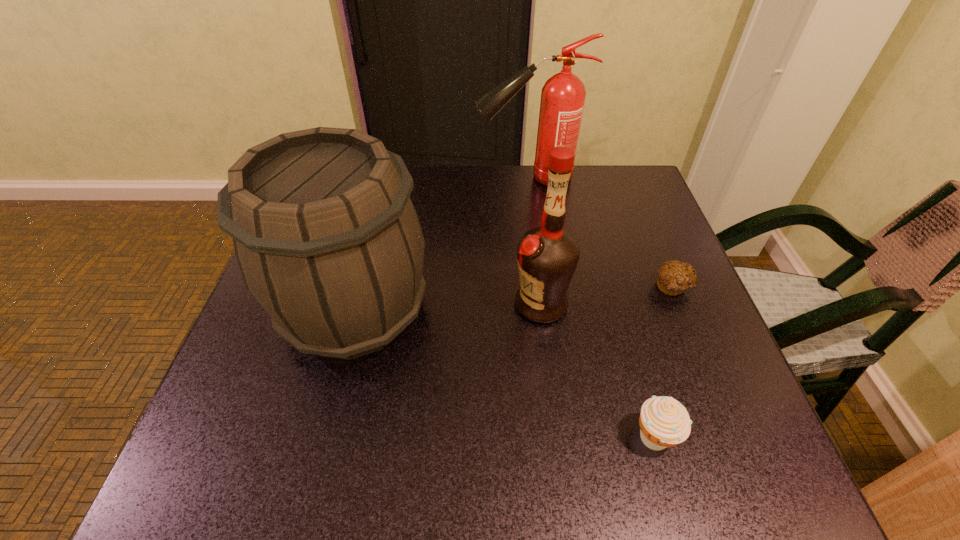
Find the location of a particular element. free region at the far edge of the desktop is located at coordinates (442, 193).

The width and height of the screenshot is (960, 540). I want to click on vacant region at the near edge, so click(513, 431).

In the image, there is a desktop. Identify the location of vacant space at the right edge. This screenshot has width=960, height=540. (642, 234).

In the image, there is a desktop. In order to click on blank space at the far right corner in this screenshot , I will do `click(580, 166)`.

Identify the location of unoccupied area between the farther muffin and the taller muffin. click(x=663, y=362).

Find the location of a particular element. This screenshot has height=540, width=960. free space between the leftmost object and the fire extinguisher is located at coordinates (442, 244).

In order to click on free area in between the wine bucket and the fire extinguisher in this screenshot , I will do `click(442, 244)`.

Find the location of `vacant area that lies between the left muffin and the wine bucket`. vacant area that lies between the left muffin and the wine bucket is located at coordinates (505, 374).

Find the location of a particular element. This screenshot has width=960, height=540. vacant point located between the farthest object and the wine bucket is located at coordinates (442, 244).

Locate an element on the screen. empty space between the fourth tallest object and the shorter muffin is located at coordinates (663, 362).